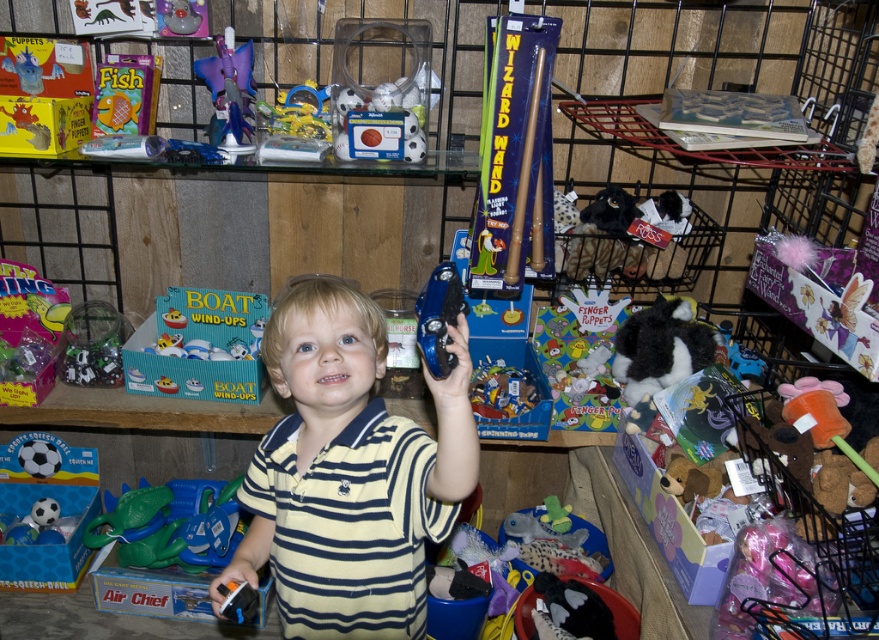
Question: Based on their relative distances, which object is farther from the purple plastic star at upper left?

Choices:
 (A) matte blue boat at center
 (B) blue plastic tambourine at upper center
 (C) fuzzy fabric stuffed animal at lower right
 (D) black plush toy at lower right

Answer: (C)

Question: Does green rubber dinosaur at lower left have a lesser width compared to purple plastic star at upper left?

Choices:
 (A) no
 (B) yes

Answer: (A)

Question: Considering the real-world distances, which object is closest to the purple plastic star at upper left?

Choices:
 (A) black plush toy at lower right
 (B) matte blue boat at center

Answer: (B)

Question: Does yellow striped shirt at center have a larger size compared to black plush toy at lower right?

Choices:
 (A) yes
 (B) no

Answer: (A)

Question: Does purple plastic star at upper left have a larger size compared to fuzzy fabric stuffed animal at lower right?

Choices:
 (A) no
 (B) yes

Answer: (A)

Question: Which point is closer to the camera?

Choices:
 (A) black plush toy at lower right
 (B) yellow striped shirt at center
 (C) blue plastic tambourine at upper center
 (D) purple plastic star at upper left

Answer: (C)